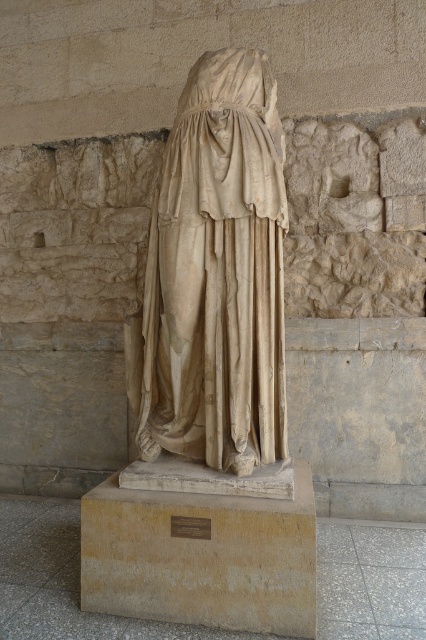
Consider the image. Who is more forward, (252, 349) or (141, 547)?

Positioned in front is point (141, 547).

Between beige stone statue at center and beige stone pedestal at center, which one has less height?

Standing shorter between the two is beige stone pedestal at center.

Is point (264, 212) positioned in front of point (193, 506)?

That is False.

At what (x,y) coordinates should I click in order to perform the action: click on beige stone statue at center. Please return your answer as a coordinate pair (x, y). This screenshot has width=426, height=640. Looking at the image, I should click on (215, 276).